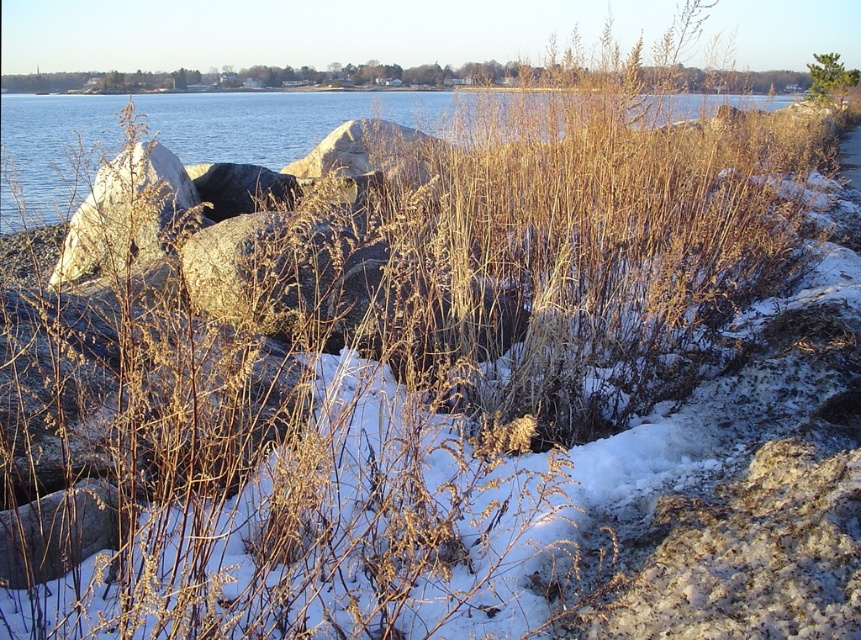
Can you confirm if blue water at upper center is shorter than green leafy tree at upper right?

No, blue water at upper center is not shorter than green leafy tree at upper right.

Who is lower down, blue water at upper center or green leafy tree at upper right?

Positioned lower is blue water at upper center.

This screenshot has width=861, height=640. What are the coordinates of `blue water at upper center` in the screenshot? It's located at (296, 120).